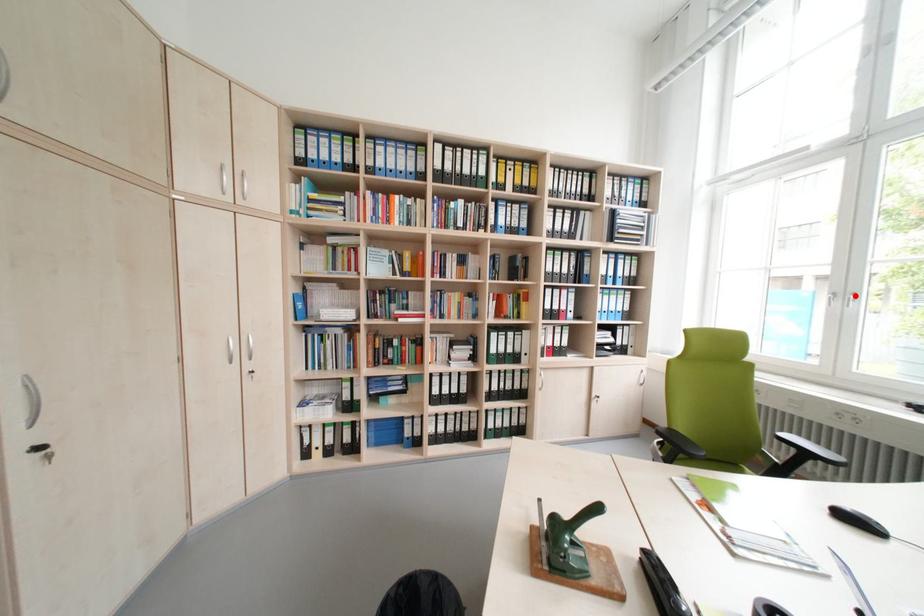
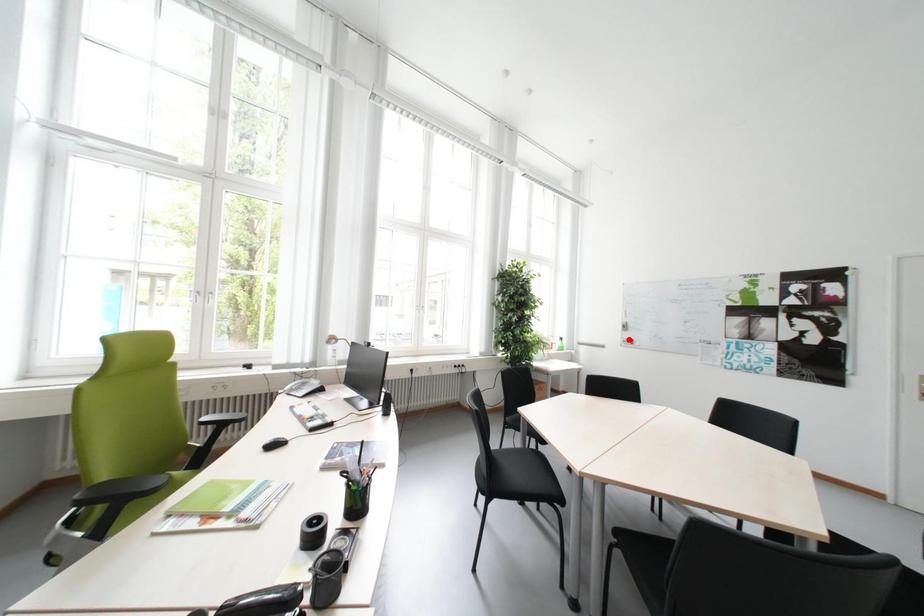
I am providing you with two images of the same scene from different viewpoints. A red point is marked on the first image and another point is marked on the second image. Are the points marked in image1 and image2 representing the same 3D position?

No